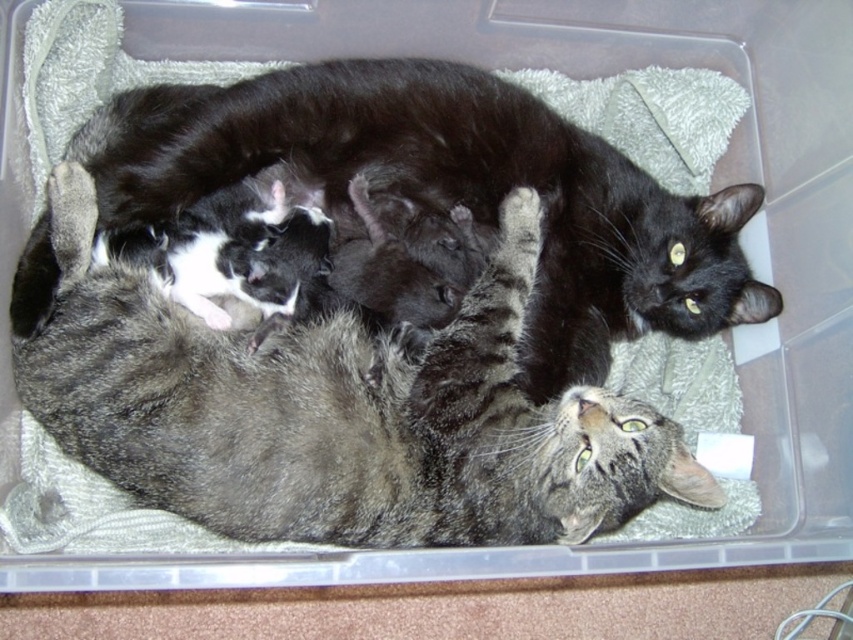
Question: Considering the relative positions of tabby fur cat at center and black fur cat at upper center in the image provided, where is tabby fur cat at center located with respect to black fur cat at upper center?

Choices:
 (A) above
 (B) below

Answer: (B)

Question: Which point appears closest to the camera in this image?

Choices:
 (A) (202, 164)
 (B) (442, 396)

Answer: (B)

Question: Is tabby fur cat at center to the right of black fur cat at upper center from the viewer's perspective?

Choices:
 (A) yes
 (B) no

Answer: (B)

Question: Which point is farther from the camera taking this photo?

Choices:
 (A) (357, 493)
 (B) (735, 220)

Answer: (B)

Question: Which of the following is the farthest from the observer?

Choices:
 (A) (160, 323)
 (B) (384, 112)

Answer: (B)

Question: Can you confirm if tabby fur cat at center is wider than black fur cat at upper center?

Choices:
 (A) yes
 (B) no

Answer: (B)